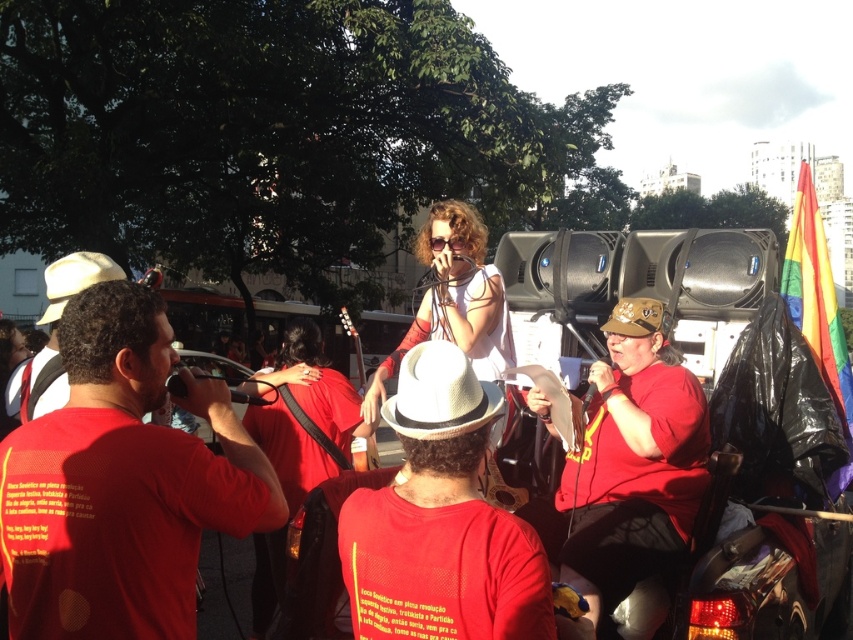
Can you confirm if red matte shirt at center is bigger than white matte cowboy hat at left?

No.

Between red matte shirt at center and white matte cowboy hat at left, which one has less height?

white matte cowboy hat at left

Who is more distant from viewer, (532, 403) or (50, 320)?

Point (532, 403)

Locate an element on the screen. This screenshot has height=640, width=853. red matte shirt at center is located at coordinates (628, 468).

Which is below, red matte shirt at center or white straw cowboy hat at center?

red matte shirt at center

Which is in front, point (677, 428) or point (447, 424)?

Point (447, 424) is more forward.

Where is `red matte shirt at center`? This screenshot has height=640, width=853. red matte shirt at center is located at coordinates (628, 468).

Which is above, white straw hat at center or white straw cowboy hat at center?

white straw cowboy hat at center is higher up.

Does point (444, 436) lie in front of point (434, 392)?

No, it is not.

Is point (483, 448) in front of point (469, 396)?

No, it is not.

Find the location of `white straw hat at center`. white straw hat at center is located at coordinates pos(440,522).